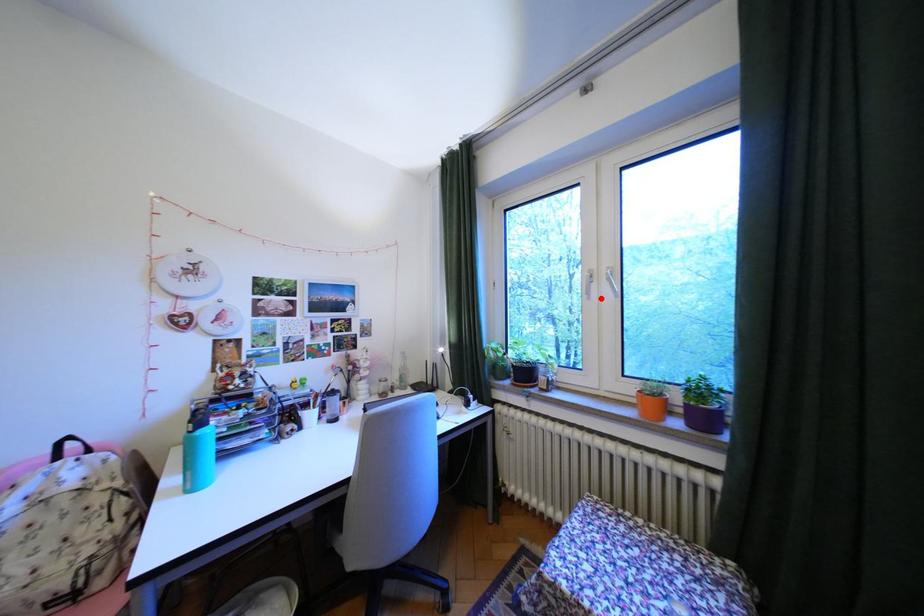
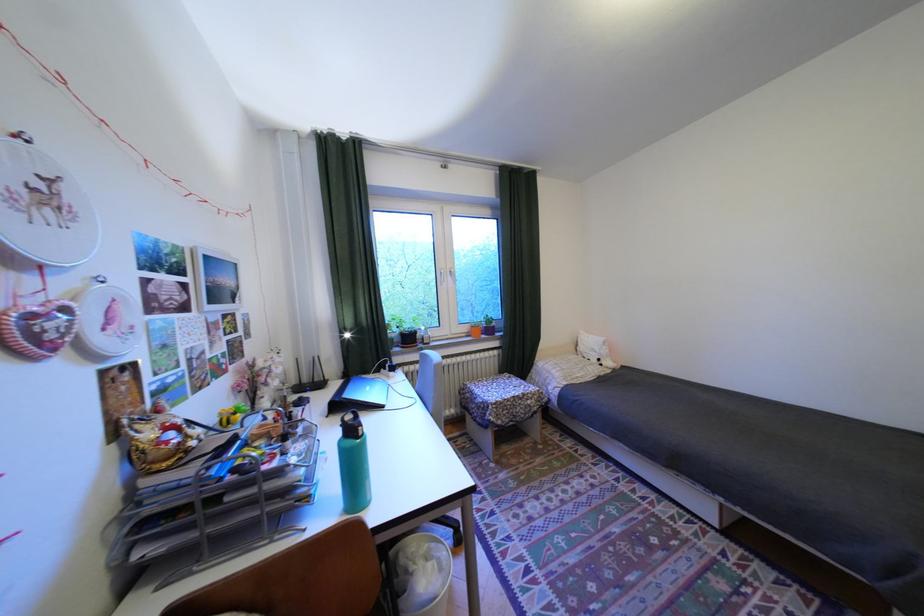
Locate, in the second image, the point that corresponds to the highlighted location in the first image.

(454, 285)